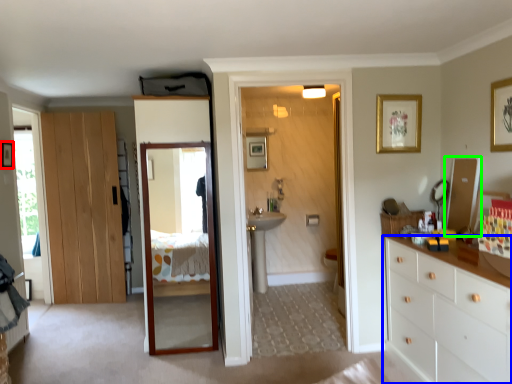
Question: Which is nearer to the picture frame (highlighted by a red box)? chest of drawers (highlighted by a blue box) or mirror (highlighted by a green box).

Choices:
 (A) chest of drawers
 (B) mirror

Answer: (B)